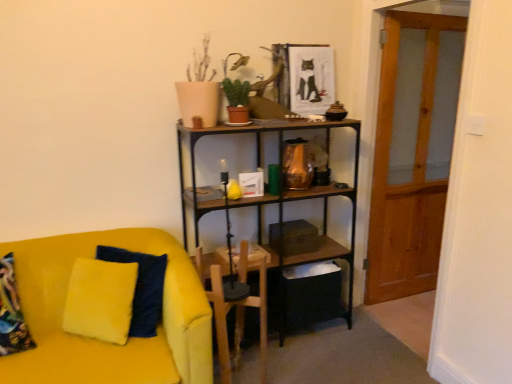
Question: From a real-world perspective, is wooden armchair at center located higher than transparent wooden door at right?

Choices:
 (A) yes
 (B) no

Answer: (B)

Question: From the image's perspective, does wooden armchair at center appear higher than transparent wooden door at right?

Choices:
 (A) no
 (B) yes

Answer: (A)

Question: From the image's perspective, is wooden armchair at center beneath transparent wooden door at right?

Choices:
 (A) no
 (B) yes

Answer: (B)

Question: Could you tell me if wooden armchair at center is turned towards transparent wooden door at right?

Choices:
 (A) no
 (B) yes

Answer: (A)

Question: Is wooden armchair at center closer to the viewer compared to transparent wooden door at right?

Choices:
 (A) yes
 (B) no

Answer: (B)

Question: From a real-world perspective, is green matte plant at upper center physically located above or below wooden armchair at center?

Choices:
 (A) below
 (B) above

Answer: (B)

Question: Considering the positions of green matte plant at upper center and wooden armchair at center in the image, is green matte plant at upper center taller or shorter than wooden armchair at center?

Choices:
 (A) tall
 (B) short

Answer: (B)

Question: Considering the positions of green matte plant at upper center and wooden armchair at center in the image, is green matte plant at upper center wider or thinner than wooden armchair at center?

Choices:
 (A) thin
 (B) wide

Answer: (A)

Question: Considering their positions, is green matte plant at upper center located in front of or behind wooden armchair at center?

Choices:
 (A) behind
 (B) front

Answer: (A)

Question: Is point (234, 102) closer or farther from the camera than point (40, 321)?

Choices:
 (A) closer
 (B) farther

Answer: (B)

Question: Is green matte plant at upper center inside the boundaries of velvet yellow couch at left, or outside?

Choices:
 (A) outside
 (B) inside

Answer: (A)

Question: Considering the positions of green matte plant at upper center and velvet yellow couch at left in the image, is green matte plant at upper center bigger or smaller than velvet yellow couch at left?

Choices:
 (A) small
 (B) big

Answer: (A)

Question: Relative to velvet yellow couch at left, is green matte plant at upper center in front or behind?

Choices:
 (A) behind
 (B) front

Answer: (A)

Question: Looking at the image, does velvet yellow couch at left seem bigger or smaller compared to green matte plant at upper center?

Choices:
 (A) big
 (B) small

Answer: (A)

Question: From the image's perspective, is velvet yellow couch at left positioned above or below green matte plant at upper center?

Choices:
 (A) below
 (B) above

Answer: (A)